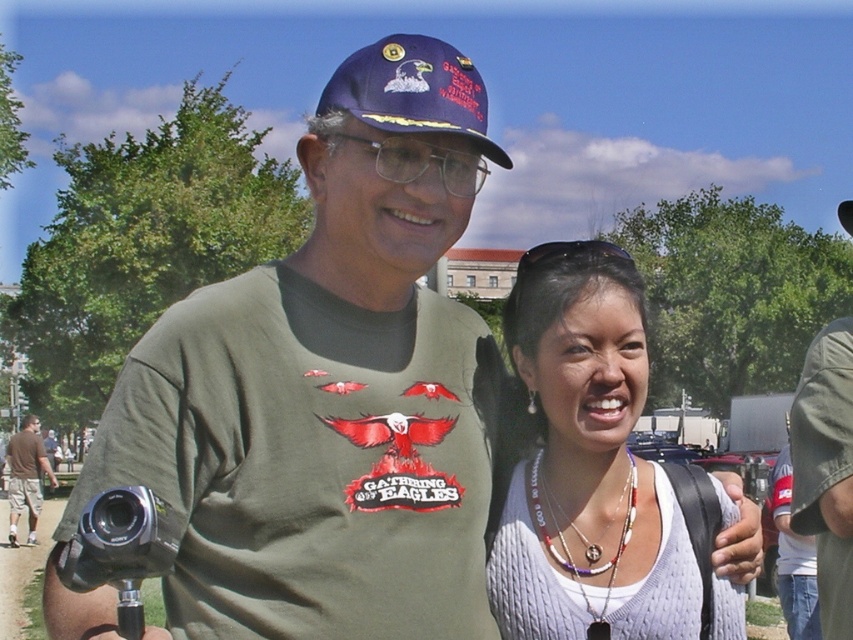
You are a photographer setting up for an event. You see the silver metallic video camera at lower left and the brown cotton shorts at lower left. Which object is shorter?

The silver metallic video camera at lower left is shorter than the brown cotton shorts at lower left.

You are standing at the origin point in the image. A blue fabric baseball cap at upper center is located at coordinates point (413, 90). If you want to move towards the blue fabric baseball cap at upper center, which direction should you move? Please provide your answer in terms of the coordinate system where the origin is at the bottom left corner of the image, with the x and y axes increasing to the right and upward respectively.

Since the point (413, 90) represents the location of the blue fabric baseball cap at upper center, you should move towards the upper center direction to reach it.

You are trying to determine the spatial relationship between the blue fabric baseball cap at upper center and the silver metallic video camera at lower left. Which object is located to the right of the other?

The blue fabric baseball cap at upper center is positioned on the right side of silver metallic video camera at lower left.